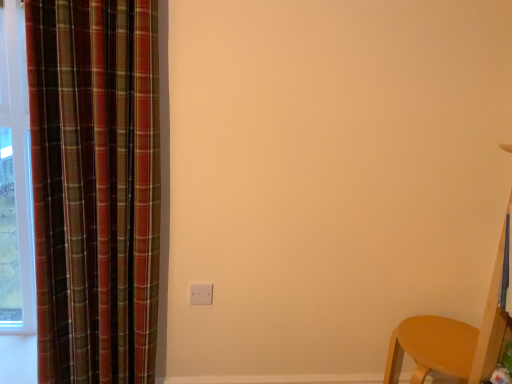
Question: From a real-world perspective, is white matte electric outlet at center on plaid fabric curtain at left?

Choices:
 (A) yes
 (B) no

Answer: (B)

Question: Can you confirm if white matte electric outlet at center is shorter than plaid fabric curtain at left?

Choices:
 (A) yes
 (B) no

Answer: (A)

Question: Is white matte electric outlet at center bigger than plaid fabric curtain at left?

Choices:
 (A) no
 (B) yes

Answer: (A)

Question: From the image's perspective, is white matte electric outlet at center above plaid fabric curtain at left?

Choices:
 (A) yes
 (B) no

Answer: (B)

Question: Is white matte electric outlet at center next to plaid fabric curtain at left?

Choices:
 (A) yes
 (B) no

Answer: (B)

Question: Based on their positions, is plaid fabric curtain at left located to the left or right of white matte electric outlet at center?

Choices:
 (A) left
 (B) right

Answer: (A)

Question: From the image's perspective, is plaid fabric curtain at left above or below white matte electric outlet at center?

Choices:
 (A) below
 (B) above

Answer: (B)

Question: In terms of height, does plaid fabric curtain at left look taller or shorter compared to white matte electric outlet at center?

Choices:
 (A) tall
 (B) short

Answer: (A)

Question: From a real-world perspective, is plaid fabric curtain at left physically located above or below white matte electric outlet at center?

Choices:
 (A) below
 (B) above

Answer: (B)

Question: Looking at the image, does matte wood chair at lower right seem bigger or smaller compared to white matte electric outlet at center?

Choices:
 (A) big
 (B) small

Answer: (A)

Question: In terms of width, does matte wood chair at lower right look wider or thinner when compared to white matte electric outlet at center?

Choices:
 (A) thin
 (B) wide

Answer: (B)

Question: From their relative heights in the image, would you say matte wood chair at lower right is taller or shorter than white matte electric outlet at center?

Choices:
 (A) short
 (B) tall

Answer: (B)

Question: Relative to white matte electric outlet at center, is matte wood chair at lower right in front or behind?

Choices:
 (A) behind
 (B) front

Answer: (B)

Question: Considering the positions of plaid fabric curtain at left and matte wood chair at lower right in the image, is plaid fabric curtain at left bigger or smaller than matte wood chair at lower right?

Choices:
 (A) big
 (B) small

Answer: (A)

Question: Is point (65, 380) closer or farther from the camera than point (509, 329)?

Choices:
 (A) closer
 (B) farther

Answer: (B)